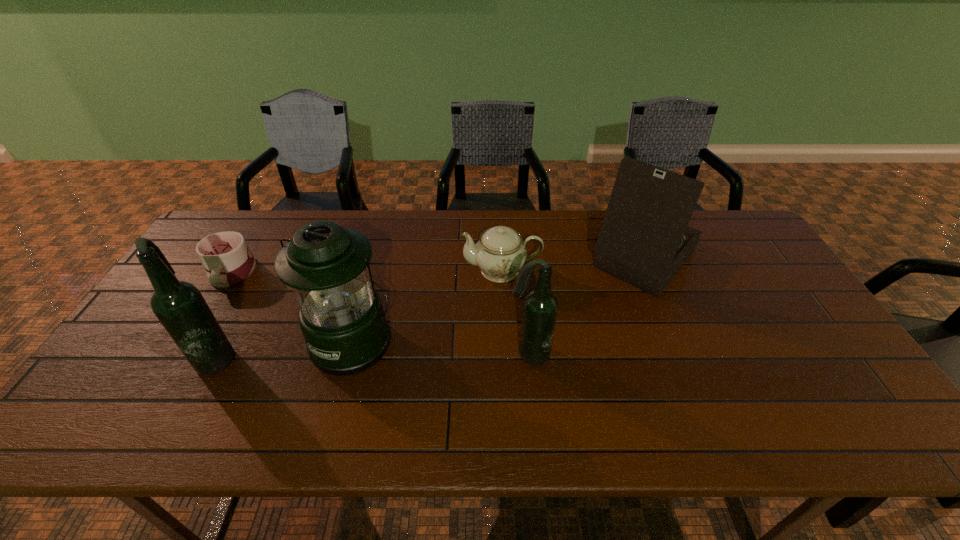
Please point a spot on the right to add another beer bottle. Please provide its 2D coordinates. Your answer should be formatted as a tuple, i.e. [(x, y)], where the tuple contains the x and y coordinates of a point satisfying the conditions above.

[(838, 352)]